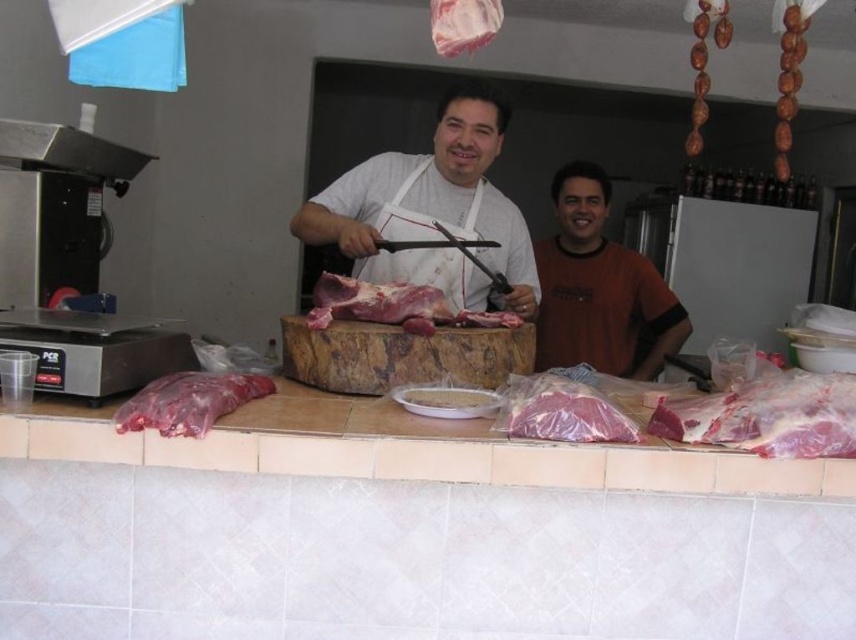
In the scene shown: Can you confirm if translucent plastic bags at lower center is positioned below brown cotton shirt at center?

Yes.

Which is behind, point (298, 429) or point (619, 333)?

Point (619, 333)

What are the coordinates of `translucent plastic bags at lower center` in the screenshot? It's located at (409, 449).

Where is `brown cotton shirt at center`? brown cotton shirt at center is located at coordinates click(x=599, y=289).

Between brown cotton shirt at center and pinkish raw meat at right, which one is positioned lower?

pinkish raw meat at right is lower down.

Who is more distant from viewer, (646,296) or (795,401)?

The point (646,296) is more distant.

Image resolution: width=856 pixels, height=640 pixels. Identify the location of brown cotton shirt at center. (599, 289).

Is translucent plastic bags at lower center to the left of white matte apron at center from the viewer's perspective?

Indeed, translucent plastic bags at lower center is positioned on the left side of white matte apron at center.

Find the location of a particular element. Image resolution: width=856 pixels, height=640 pixels. translucent plastic bags at lower center is located at coordinates (409, 449).